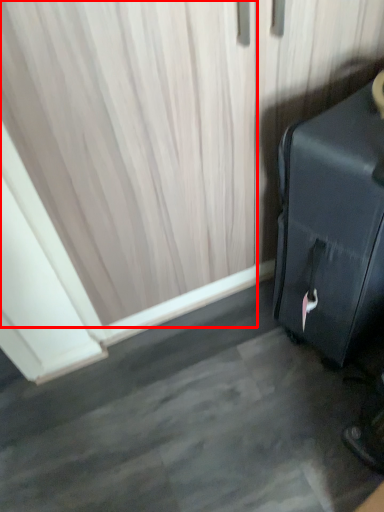
Question: From the image, what is the correct spatial relationship of curtain (annotated by the red box) in relation to suitcase?

Choices:
 (A) left
 (B) right

Answer: (A)